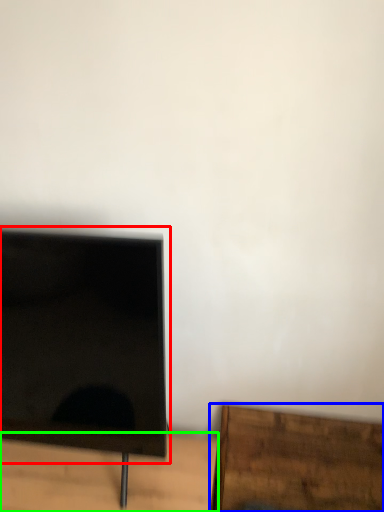
Question: Which object is the closest to the computer monitor (highlighted by a red box)? Choose among these: furniture (highlighted by a blue box) or table (highlighted by a green box).

Choices:
 (A) furniture
 (B) table

Answer: (B)